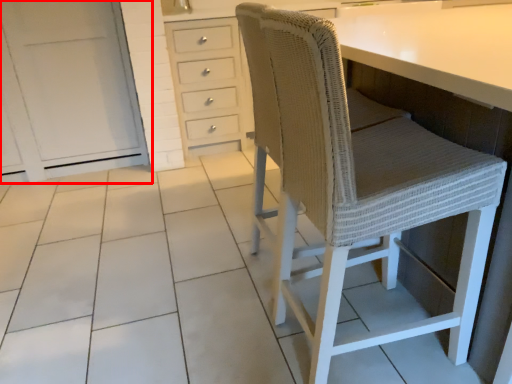
Question: From the image's perspective, considering the relative positions of cabinetry (annotated by the red box) and chair in the image provided, where is cabinetry (annotated by the red box) located with respect to the staircase?

Choices:
 (A) below
 (B) above

Answer: (B)